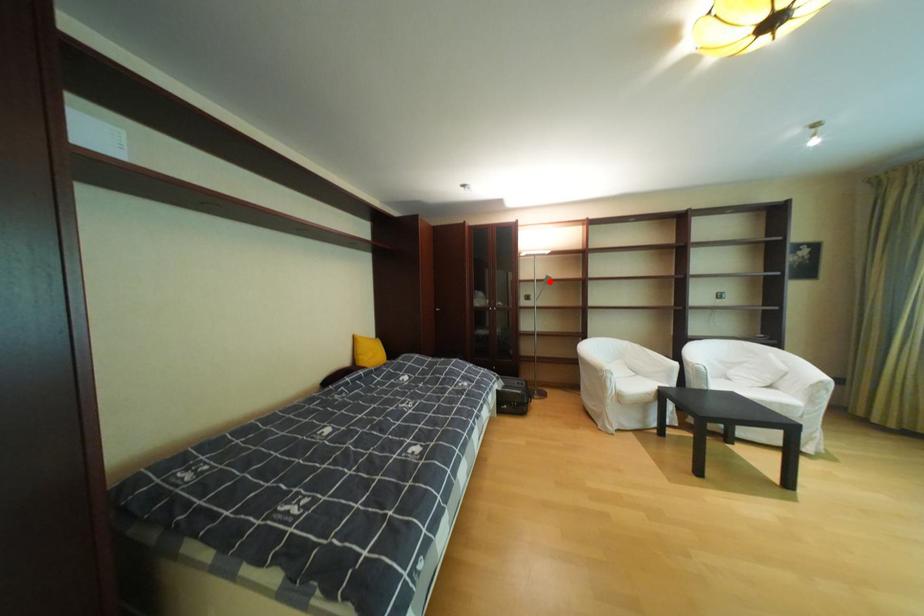
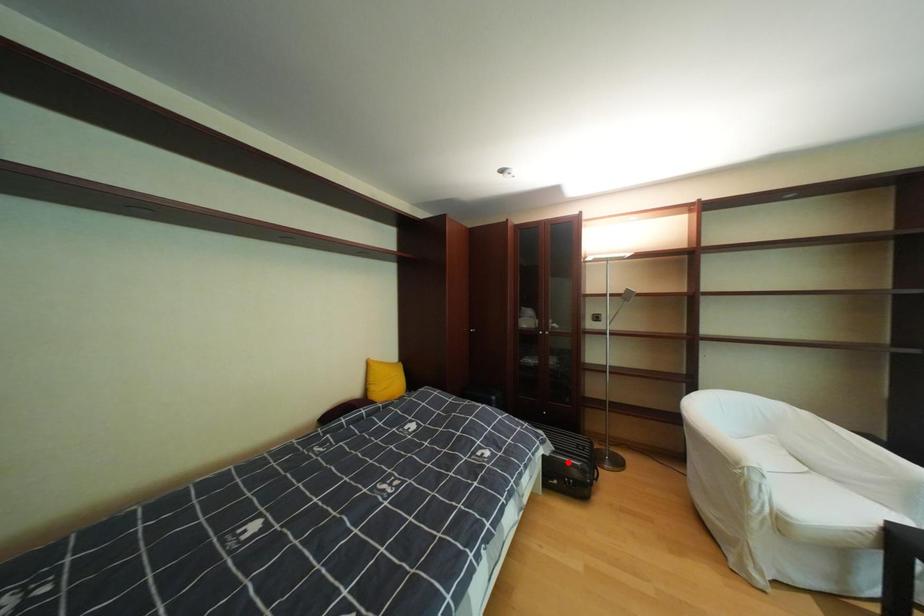
I am providing you with two images of the same scene from different viewpoints. A red point is marked on the first image and another point is marked on the second image. Is the marked point in image1 the same physical position as the marked point in image2?

No